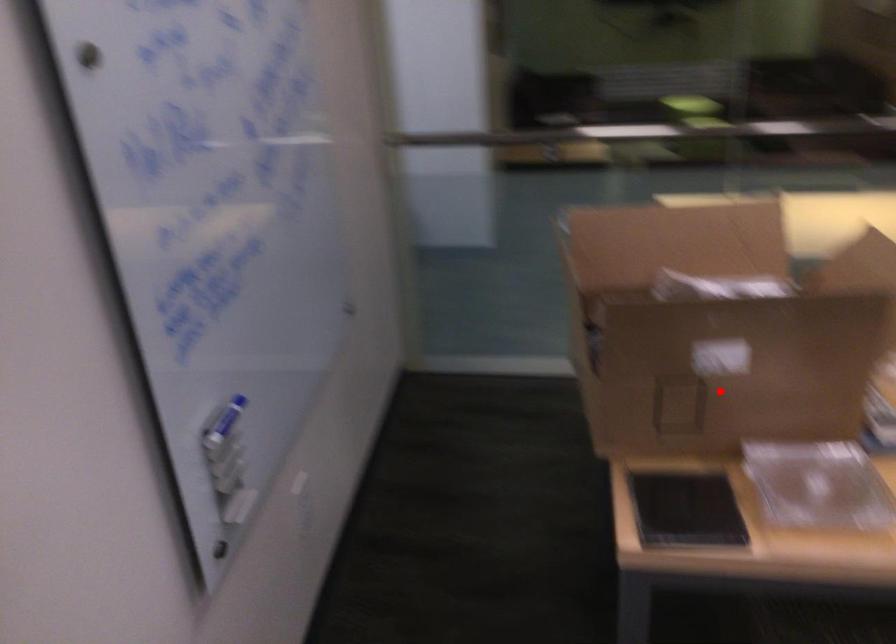
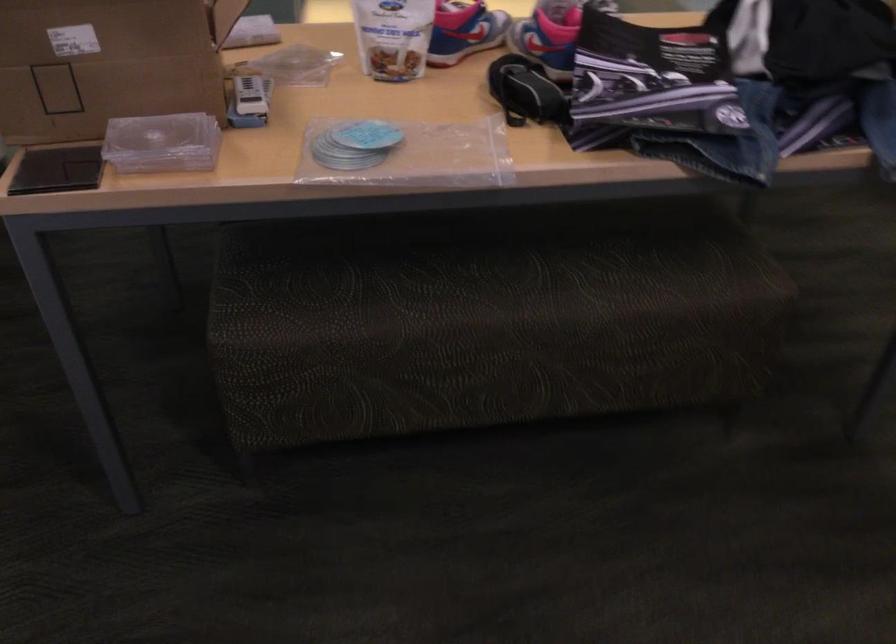
Where in the second image is the point corresponding to the highlighted location from the first image?

(107, 62)